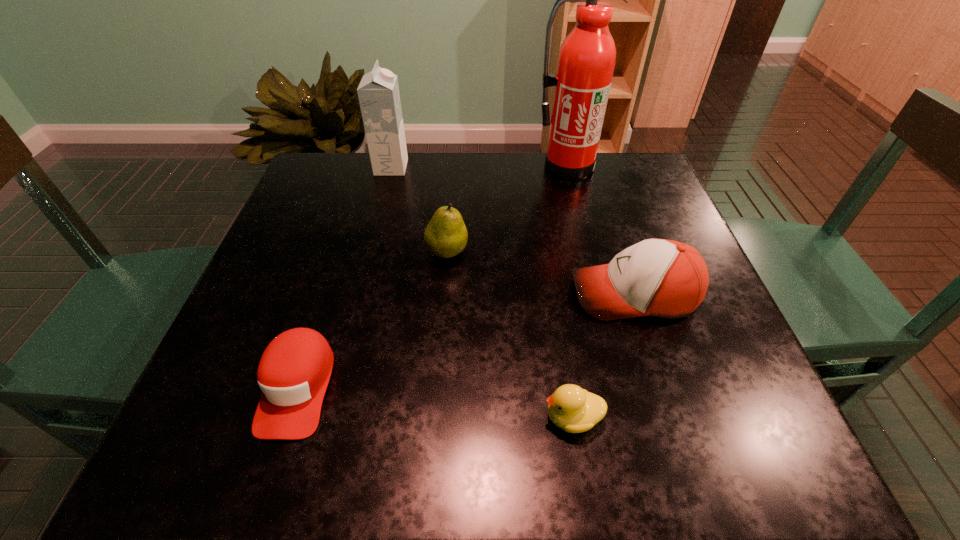
Where is `unoccupied area between the duckling and the taller baseball cap`? unoccupied area between the duckling and the taller baseball cap is located at coordinates (603, 356).

Identify the location of free space that is in between the second tallest object and the third farthest object. 420,210.

What are the coordinates of `free space between the pear and the duckling` in the screenshot? It's located at (510, 334).

This screenshot has width=960, height=540. Identify the location of unoccupied position between the fourth farthest object and the left baseball cap. (466, 340).

You are a GUI agent. You are given a task and a screenshot of the screen. Output one action in this format:
    pyautogui.click(x=<x>, y=<y>)
    Task: Click on the fifth closest object to the third object from left to right
    The width and height of the screenshot is (960, 540).
    Given the screenshot: What is the action you would take?
    pyautogui.click(x=573, y=409)

Identify which object is located as the second nearest to the second tallest object. Please provide its 2D coordinates. Your answer should be formatted as a tuple, i.e. [(x, y)], where the tuple contains the x and y coordinates of a point satisfying the conditions above.

[(586, 61)]

You are a GUI agent. You are given a task and a screenshot of the screen. Output one action in this format:
    pyautogui.click(x=<x>, y=<y>)
    Task: Click on the free space that satisfies the following two spatial constraints: 1. on the front label of the second tallest object; 2. on the front-facing side of the shorter baseball cap
    The image size is (960, 540).
    Given the screenshot: What is the action you would take?
    pyautogui.click(x=335, y=387)

The width and height of the screenshot is (960, 540). I want to click on vacant point that satisfies the following two spatial constraints: 1. on the front-facing side of the right baseball cap; 2. on the front-facing side of the nearer baseball cap, so click(664, 387).

What are the coordinates of `free space that satisfies the following two spatial constraints: 1. on the label side of the fire extinguisher; 2. on the beak of the duckling` in the screenshot? It's located at (629, 417).

This screenshot has width=960, height=540. What are the coordinates of `vacant region that satisfies the following two spatial constraints: 1. on the label side of the fire extinguisher; 2. on the beak of the duckling` in the screenshot? It's located at (629, 417).